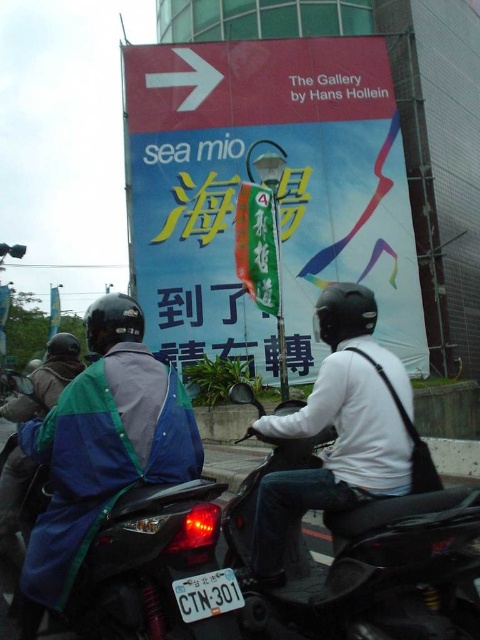
Question: Does matte blue motorcycle at center have a greater width compared to white matte helmet at upper center?

Choices:
 (A) no
 (B) yes

Answer: (B)

Question: Among these objects, which one is nearest to the camera?

Choices:
 (A) white matte helmet at upper center
 (B) matte plastic signboard at center
 (C) black matte motorcycle at center
 (D) matte blue motorcycle at center

Answer: (D)

Question: In this image, where is matte plastic signboard at center located relative to matte blue motorcycle at center?

Choices:
 (A) below
 (B) above

Answer: (B)

Question: Which point is closer to the camera?

Choices:
 (A) (285, 616)
 (B) (194, 560)
 (C) (189, 83)

Answer: (B)

Question: Which is farther from the black matte motorcycle at center?

Choices:
 (A) white matte helmet at upper center
 (B) matte blue motorcycle at center
 (C) matte plastic signboard at center

Answer: (C)

Question: Does matte blue motorcycle at center have a larger size compared to white matte helmet at upper center?

Choices:
 (A) no
 (B) yes

Answer: (B)